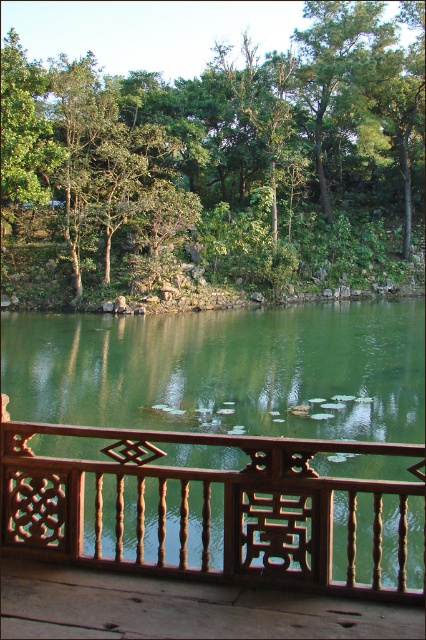
You are standing on the wooden balcony and want to place a small potted plant between the two points marked as point [216,513] and point [198,632]. Which point is closer to you when placing the plant?

Point [216,513] is closer to you than point [198,632] because it is further to the viewer, meaning it is positioned nearer in the scene.

You are standing on the wooden balcony and want to take a photo of the wooden at lower center without the green leafy tree at center blocking it. How should you position yourself?

The wooden at lower center is behind the green leafy tree at center, so to avoid the tree blocking the view, you should position yourself behind the green leafy tree at center to ensure the wooden at lower center is visible.